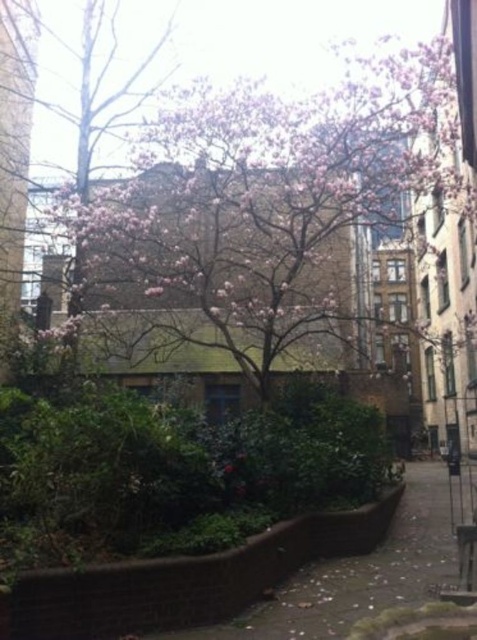
Identify the location of pink bloom tree at center. The width and height of the screenshot is (477, 640). (265, 211).

How far apart are pink bloom tree at center and brown concrete pavement at lower center?

They are 6.04 meters apart.

Where is `pink bloom tree at center`? Image resolution: width=477 pixels, height=640 pixels. pink bloom tree at center is located at coordinates (265, 211).